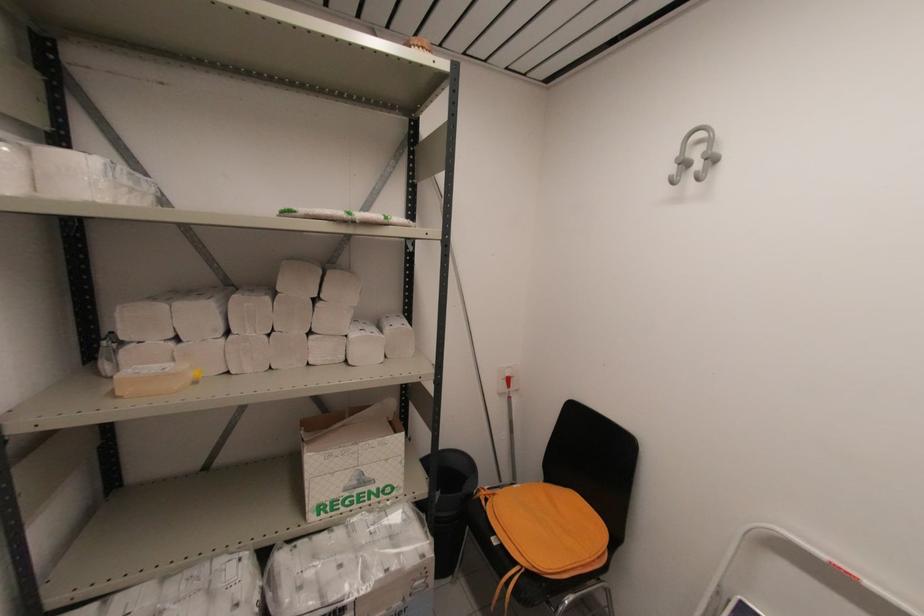
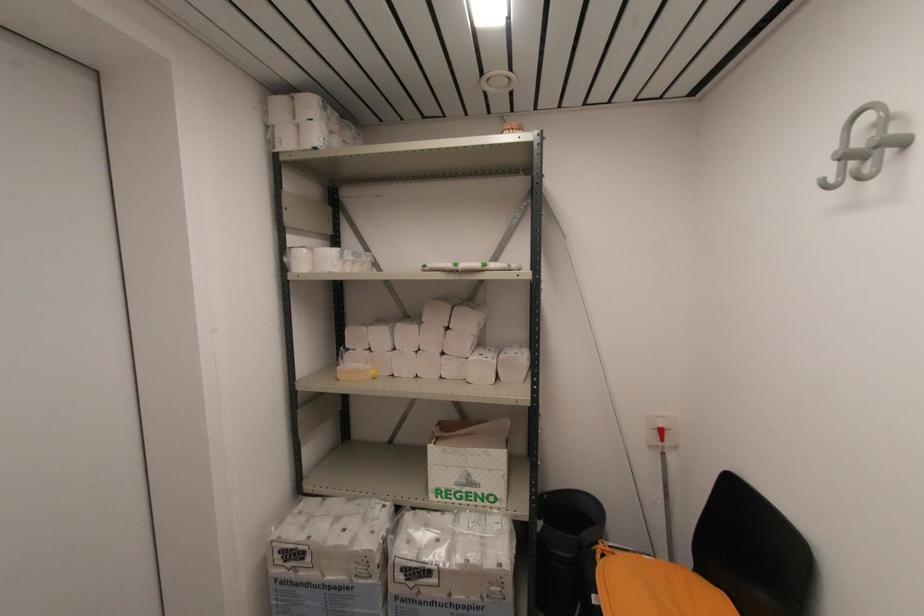
In the second image, find the point that corresponds to point 681,164 in the first image.

(843, 160)